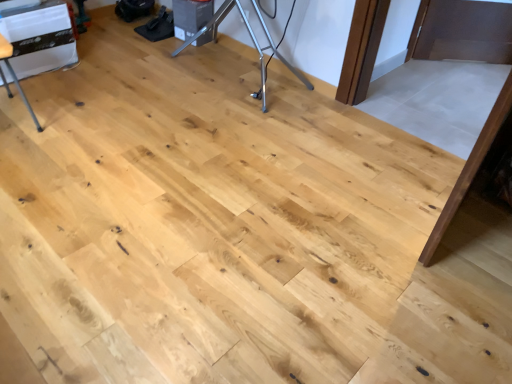
In order to click on free location in front of silver metallic tripod at center in this screenshot , I will do `click(196, 135)`.